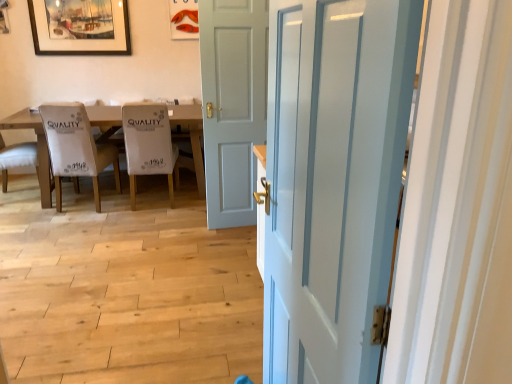
In order to click on white fabric chair at center, placed as the 3th chair when sorted from left to right in this screenshot , I will do `click(149, 145)`.

Measure the distance between point (150, 130) and camera.

3.58 meters.

The width and height of the screenshot is (512, 384). Describe the element at coordinates (333, 180) in the screenshot. I see `white glossy door at center, which appears as the first door when viewed from the right` at that location.

The image size is (512, 384). What do you see at coordinates (232, 104) in the screenshot?
I see `light gray wood door at center, which is the 2th door from right to left` at bounding box center [232, 104].

Locate an element on the screen. wooden table at left is located at coordinates (38, 147).

You are a GUI agent. You are given a task and a screenshot of the screen. Output one action in this format:
    pyautogui.click(x=<x>, y=<y>)
    Task: Click on the white fabric chair at left, which is the first chair in left-to-right order
    
    Given the screenshot: What is the action you would take?
    pyautogui.click(x=17, y=158)

This screenshot has height=384, width=512. Find the location of `white fabric chair at left, which is the 2th chair from left to right`. white fabric chair at left, which is the 2th chair from left to right is located at coordinates (76, 148).

Locate an element on the screen. white fabric chair at center, placed as the 3th chair when sorted from left to right is located at coordinates (149, 145).

Can you tell me how much white glossy door at center, the 1th door in the front-to-back sequence, and wooden framed painting at upper left differ in facing direction?

white glossy door at center, the 1th door in the front-to-back sequence, and wooden framed painting at upper left are facing 89.8 degrees away from each other.

In the scene shown: Can you confirm if white glossy door at center, the 2th door viewed from the back, is shorter than wooden framed painting at upper left?

No.

From a real-world perspective, is white glossy door at center, the 1th door in the front-to-back sequence, under wooden framed painting at upper left?

Indeed, from a real-world perspective, white glossy door at center, the 1th door in the front-to-back sequence, is positioned beneath wooden framed painting at upper left.

Is white glossy door at center, the 2th door viewed from the back, looking in the opposite direction of wooden framed painting at upper left?

No.

Between wooden table at left and white fabric chair at left, the 2th chair viewed from the right, which one appears on the left side from the viewer's perspective?

From the viewer's perspective, white fabric chair at left, the 2th chair viewed from the right, appears more on the left side.

Does wooden table at left have a greater height compared to white fabric chair at left, the 2th chair viewed from the right?

No.

Image resolution: width=512 pixels, height=384 pixels. In order to click on kitchen & dining room table lying on the right of white fabric chair at left, which is the 2th chair from left to right in this screenshot , I will do `click(38, 147)`.

Can we say wooden table at left lies outside white fabric chair at left, the 2th chair viewed from the right?

Yes, wooden table at left is located beyond the bounds of white fabric chair at left, the 2th chair viewed from the right.

How many degrees apart are the facing directions of wooden table at left and white glossy door at center, the 1th door in the front-to-back sequence?

The angle between the facing direction of wooden table at left and the facing direction of white glossy door at center, the 1th door in the front-to-back sequence, is 89.8 degrees.

Who is more distant, wooden table at left or white glossy door at center, which appears as the first door when viewed from the right?

Positioned behind is wooden table at left.

Which of these two, wooden table at left or white glossy door at center, the 2th door viewed from the back, is smaller?

With smaller size is white glossy door at center, the 2th door viewed from the back.

Would you say wooden table at left is outside white glossy door at center, the 2th door viewed from the back?

Absolutely, wooden table at left is external to white glossy door at center, the 2th door viewed from the back.

Can you confirm if white glossy door at center, the 1th door in the front-to-back sequence, is wider than wooden table at left?

No, white glossy door at center, the 1th door in the front-to-back sequence, is not wider than wooden table at left.

From the picture: From their relative heights in the image, would you say white glossy door at center, the 1th door in the front-to-back sequence, is taller or shorter than wooden table at left?

Considering their sizes, white glossy door at center, the 1th door in the front-to-back sequence, has more height than wooden table at left.

From a real-world perspective, which object stands above the other?

white glossy door at center, which appears as the first door when viewed from the right, is physically above.

Is white glossy door at center, the 1th door in the front-to-back sequence, at the left side of wooden table at left?

In fact, white glossy door at center, the 1th door in the front-to-back sequence, is to the right of wooden table at left.

Between light gray wood door at center, which is the 2th door from right to left, and white fabric chair at left, the 3th chair from the right, which one is positioned behind?

white fabric chair at left, the 3th chair from the right, is more distant.

Can you confirm if light gray wood door at center, marked as the 1th door in a left-to-right arrangement, is thinner than white fabric chair at left, which is the first chair in left-to-right order?

Correct, the width of light gray wood door at center, marked as the 1th door in a left-to-right arrangement, is less than that of white fabric chair at left, which is the first chair in left-to-right order.

Is light gray wood door at center, which is the 2th door from right to left, placed right next to white fabric chair at left, the 3th chair from the right?

No.

Considering the positions of objects light gray wood door at center, which is the 2th door from right to left, and white fabric chair at left, which is the first chair in left-to-right order, in the image provided, who is more to the left, light gray wood door at center, which is the 2th door from right to left, or white fabric chair at left, which is the first chair in left-to-right order,?

white fabric chair at left, which is the first chair in left-to-right order.

Can you confirm if wooden framed painting at upper left is taller than wooden table at left?

No, wooden framed painting at upper left is not taller than wooden table at left.

Considering the sizes of wooden framed painting at upper left and wooden table at left in the image, is wooden framed painting at upper left bigger or smaller than wooden table at left?

Considering their sizes, wooden framed painting at upper left takes up less space than wooden table at left.

Is wooden framed painting at upper left in contact with wooden table at left?

wooden framed painting at upper left is not next to wooden table at left, and they're not touching.

Is wooden framed painting at upper left not within wooden table at left?

Yes, wooden framed painting at upper left is outside of wooden table at left.

Considering the positions of points (5, 165) and (100, 52), is point (5, 165) closer to camera compared to point (100, 52)?

Yes.

From a real-world perspective, is white fabric chair at left, which is the first chair in left-to-right order, on top of wooden framed painting at upper left?

No, from a real-world perspective, white fabric chair at left, which is the first chair in left-to-right order, is not on top of wooden framed painting at upper left.

Is white fabric chair at left, which is the first chair in left-to-right order, positioned before wooden framed painting at upper left?

Yes, white fabric chair at left, which is the first chair in left-to-right order, is closer to the camera.

This screenshot has height=384, width=512. Find the location of `the 2nd door below the wooden framed painting at upper left (from the image's perspective)`. the 2nd door below the wooden framed painting at upper left (from the image's perspective) is located at coordinates (333, 180).

Locate an element on the screen. The height and width of the screenshot is (384, 512). the 2nd chair in front when counting from the wooden table at left is located at coordinates (76, 148).

Considering their positions, is white glossy door at center, arranged as the 2th door when viewed from the left, positioned further to light gray wood door at center, which is the 2th door from right to left, than white fabric chair at left, which is the 2th chair from left to right?

The object further to light gray wood door at center, which is the 2th door from right to left, is white glossy door at center, arranged as the 2th door when viewed from the left.

Considering their positions, is white fabric chair at center, placed as the 3th chair when sorted from left to right, positioned further to white fabric chair at left, which is the first chair in left-to-right order, than light gray wood door at center, which is counted as the second door, starting from the front?

The object further to white fabric chair at left, which is the first chair in left-to-right order, is light gray wood door at center, which is counted as the second door, starting from the front.

Looking at this image, from the image, which object appears to be nearer to white fabric chair at center, marked as the first chair in a right-to-left arrangement, white glossy door at center, which appears as the first door when viewed from the right, or wooden table at left?

wooden table at left lies closer to white fabric chair at center, marked as the first chair in a right-to-left arrangement, than the other object.

Which object lies nearer to the anchor point white fabric chair at center, marked as the first chair in a right-to-left arrangement, wooden framed painting at upper left or white fabric chair at left, the 3th chair from the right?

white fabric chair at left, the 3th chair from the right, is closer to white fabric chair at center, marked as the first chair in a right-to-left arrangement.

Which object lies nearer to the anchor point white fabric chair at center, placed as the 3th chair when sorted from left to right, light gray wood door at center, which appears as the 1th door when viewed from the back, or white glossy door at center, arranged as the 2th door when viewed from the left?

The object closer to white fabric chair at center, placed as the 3th chair when sorted from left to right, is light gray wood door at center, which appears as the 1th door when viewed from the back.

When comparing their distances from white glossy door at center, the 1th door in the front-to-back sequence, does white fabric chair at left, which is the 2th chair from left to right, or light gray wood door at center, marked as the 1th door in a left-to-right arrangement, seem further?

white fabric chair at left, which is the 2th chair from left to right, is positioned further to the anchor white glossy door at center, the 1th door in the front-to-back sequence.

Which object lies nearer to the anchor point white fabric chair at left, the 2th chair viewed from the right, wooden table at left or white fabric chair at left, the 3th chair from the right?

Among the two, white fabric chair at left, the 3th chair from the right, is located nearer to white fabric chair at left, the 2th chair viewed from the right.

Looking at the image, which one is located closer to wooden framed painting at upper left, light gray wood door at center, marked as the 1th door in a left-to-right arrangement, or wooden table at left?

wooden table at left.

The width and height of the screenshot is (512, 384). In order to click on door positioned between white glossy door at center, which appears as the first door when viewed from the right, and white fabric chair at left, the 3th chair from the right, from near to far in this screenshot , I will do `click(232, 104)`.

Find the location of `kitchen & dining room table located between white glossy door at center, arranged as the 2th door when viewed from the left, and wooden framed painting at upper left in the depth direction`. kitchen & dining room table located between white glossy door at center, arranged as the 2th door when viewed from the left, and wooden framed painting at upper left in the depth direction is located at coordinates (38, 147).

The width and height of the screenshot is (512, 384). Identify the location of door between white glossy door at center, the 1th door in the front-to-back sequence, and wooden table at left, along the z-axis. (232, 104).

I want to click on kitchen & dining room table situated between white fabric chair at left, which is the 2th chair from left to right, and light gray wood door at center, which is the 2th door from right to left, from left to right, so click(x=38, y=147).